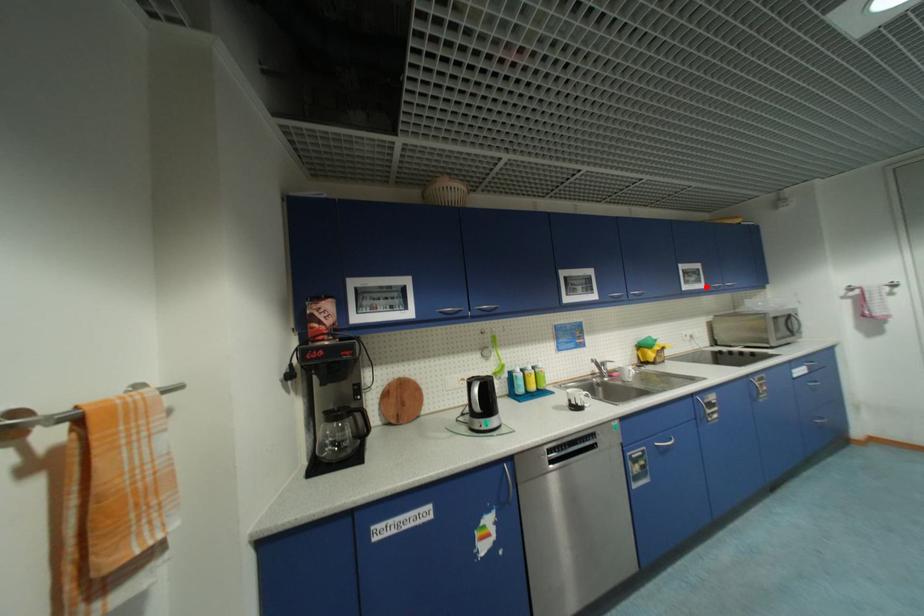
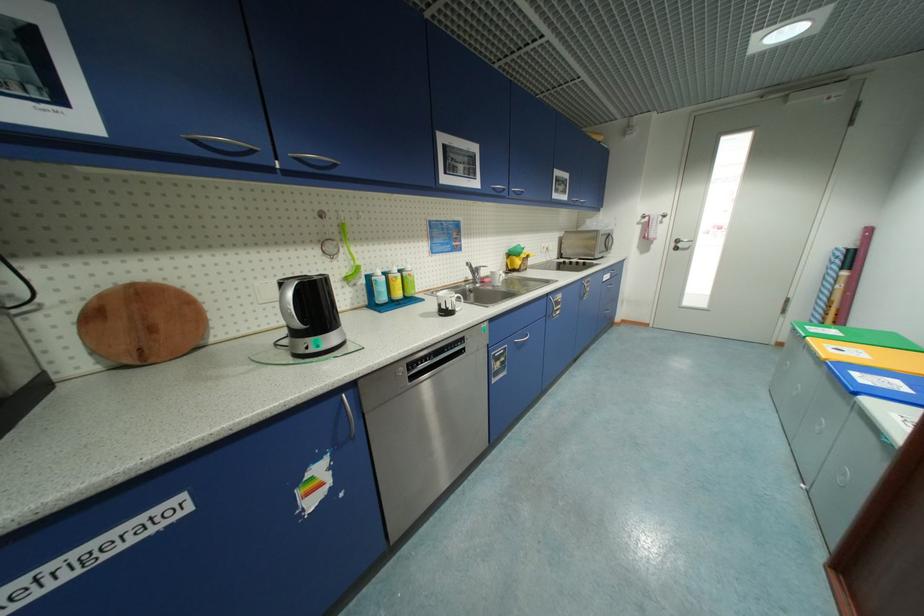
The point at the highlighted location is marked in the first image. Where is the corresponding point in the second image?

(570, 199)